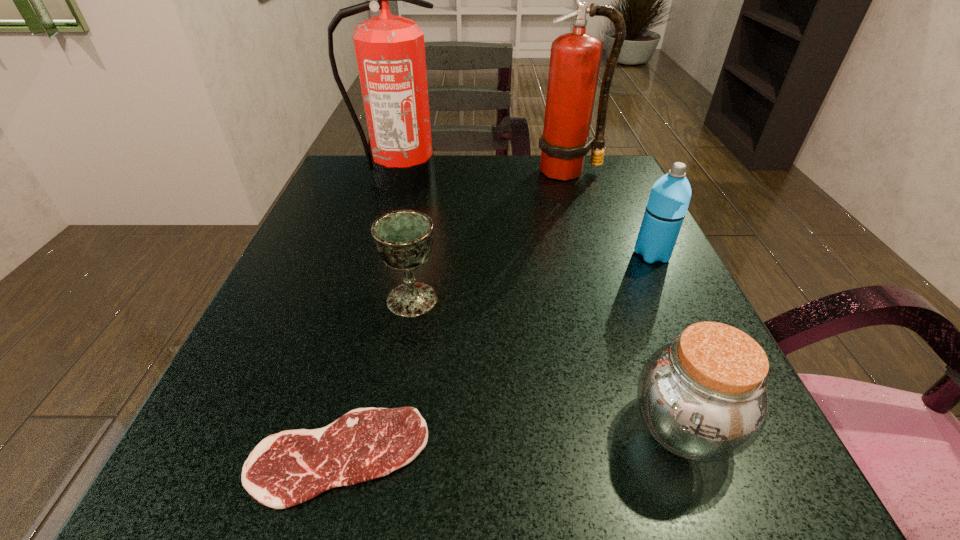
At what (x,y) coordinates should I click in order to perform the action: click on the left fire extinguisher. Please return your answer as a coordinate pair (x, y). This screenshot has height=540, width=960. Looking at the image, I should click on (390, 51).

Where is `the right fire extinguisher`? The image size is (960, 540). the right fire extinguisher is located at coordinates (575, 58).

Where is `the fourth shortest object`? The height and width of the screenshot is (540, 960). the fourth shortest object is located at coordinates [667, 205].

The image size is (960, 540). I want to click on thermos bottle, so click(x=667, y=205).

The image size is (960, 540). In order to click on chalice in this screenshot , I will do `click(403, 239)`.

Identify the location of jar. The width and height of the screenshot is (960, 540). (703, 397).

Where is `the shortest object`? Image resolution: width=960 pixels, height=540 pixels. the shortest object is located at coordinates (285, 469).

Image resolution: width=960 pixels, height=540 pixels. I want to click on free spot located 0.260m on the front side of the left fire extinguisher, so click(x=374, y=266).

I want to click on free space located at the nozzle of the right fire extinguisher, so click(x=601, y=271).

I want to click on free spot located 0.320m on the back of the third farthest object, so click(x=611, y=167).